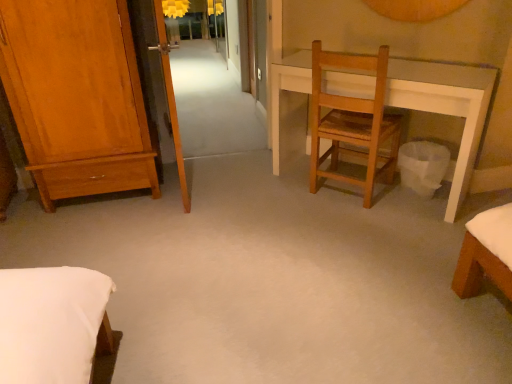
Locate an element on the screen. The height and width of the screenshot is (384, 512). vacant region in front of white paper trash can at lower right is located at coordinates (421, 221).